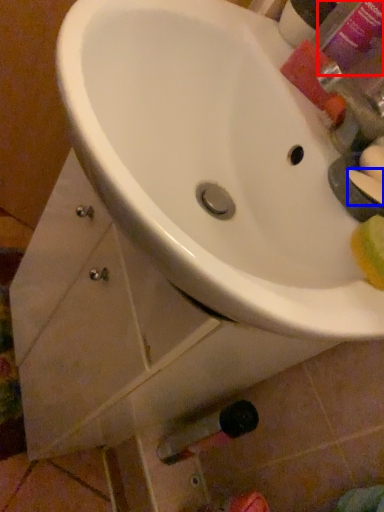
Question: Which object appears farthest to the camera in this image, mouthwash (highlighted by a red box) or soap (highlighted by a blue box)?

Choices:
 (A) mouthwash
 (B) soap

Answer: (A)